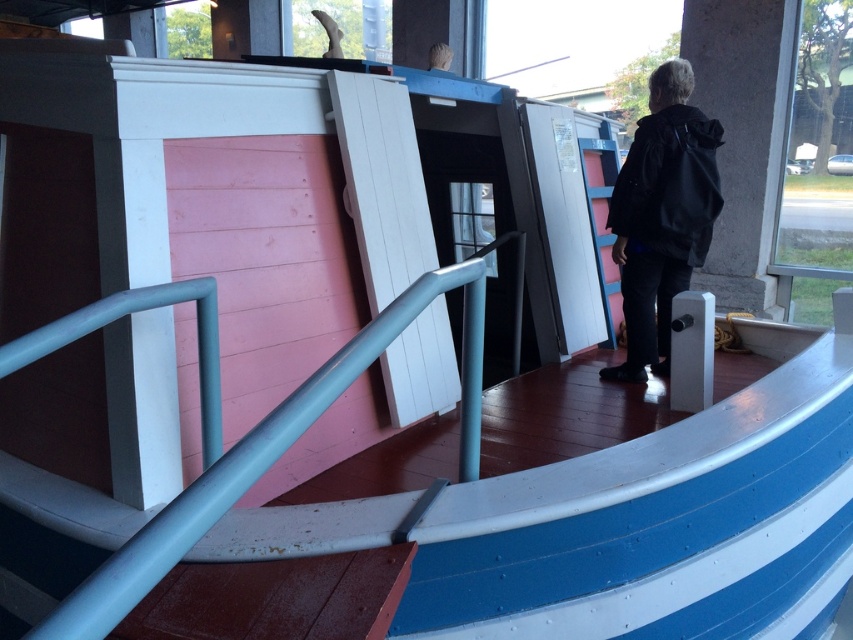
Question: Can you confirm if gray concrete pillar at right is positioned to the left of black matte jacket at center?

Choices:
 (A) no
 (B) yes

Answer: (A)

Question: Is gray concrete pillar at right to the right of black matte jacket at center from the viewer's perspective?

Choices:
 (A) yes
 (B) no

Answer: (A)

Question: Is gray concrete pillar at right below black matte jacket at center?

Choices:
 (A) yes
 (B) no

Answer: (B)

Question: Which object appears closest to the camera in this image?

Choices:
 (A) black matte jacket at center
 (B) gray concrete pillar at right

Answer: (A)